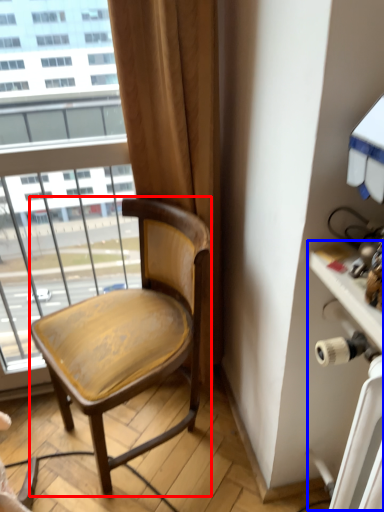
Question: Among these objects, which one is nearest to the camera, chair (highlighted by a red box) or table (highlighted by a blue box)?

Choices:
 (A) chair
 (B) table

Answer: (B)